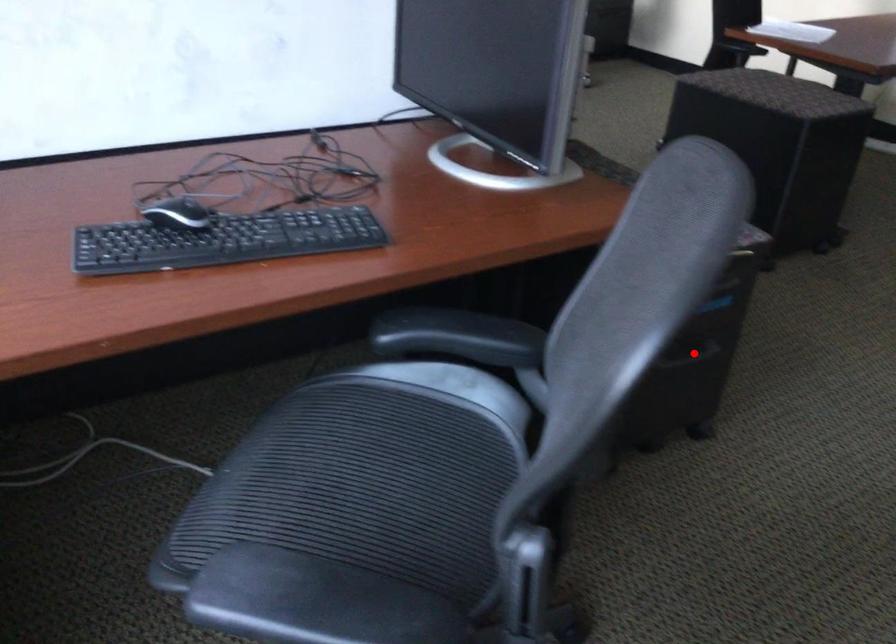
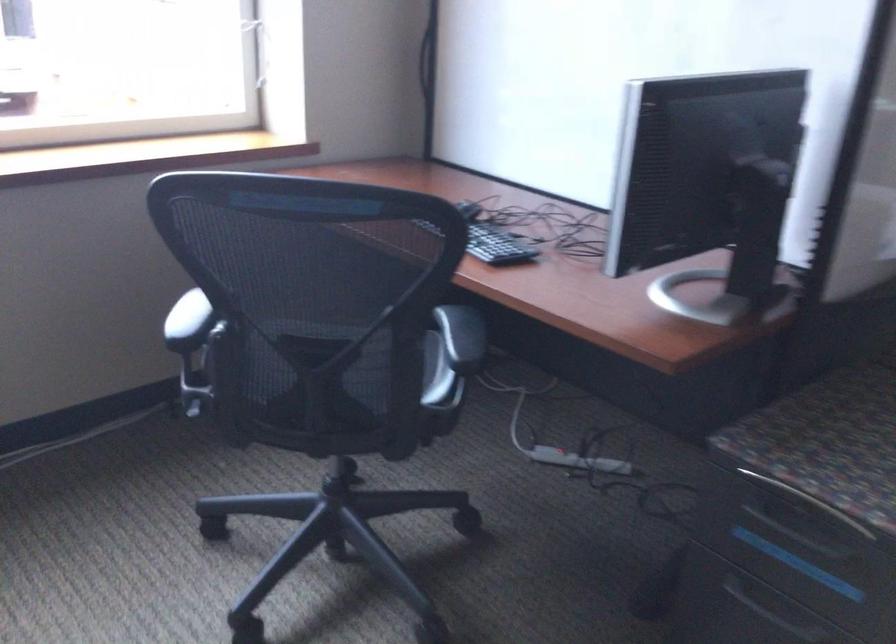
Question: A red point is marked in image1. In image2, is the corresponding 3D point closer to the camera or farther? Reply with the corresponding letter.

Choices:
 (A) The corresponding 3D point is closer.
 (B) The corresponding 3D point is farther.

Answer: (A)